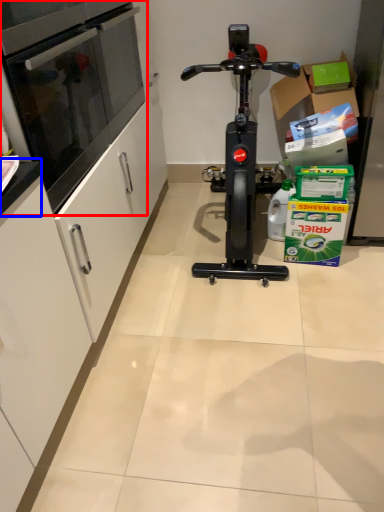
Question: Among these objects, which one is nearest to the camera, oven (highlighted by a red box) or counter top (highlighted by a blue box)?

Choices:
 (A) oven
 (B) counter top

Answer: (B)